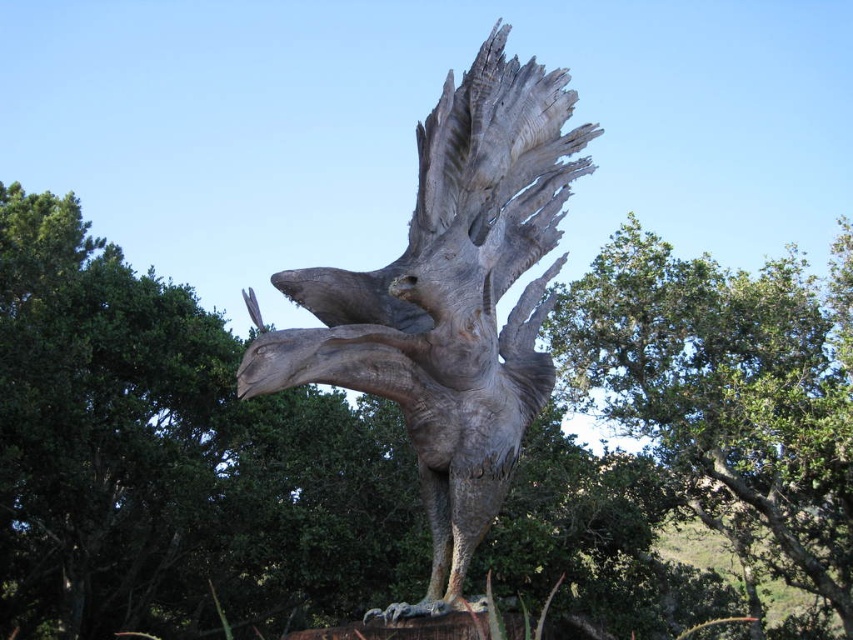
You are an artist planning to paint this sculpture. You have a canvas that can only accommodate objects up to the size of the green leafy tree at center. Will the gray stone eagle at center fit on your canvas?

The green leafy tree at center is wider than the gray stone eagle at center, so the gray stone eagle at center will fit on the canvas since its width is smaller than the tree.